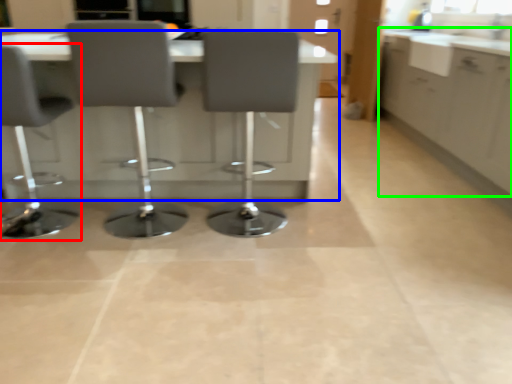
Question: Estimate the real-world distances between objects in this image. Which object is closer to chair (highlighted by a red box), table (highlighted by a blue box) or cabinetry (highlighted by a green box)?

Choices:
 (A) table
 (B) cabinetry

Answer: (A)